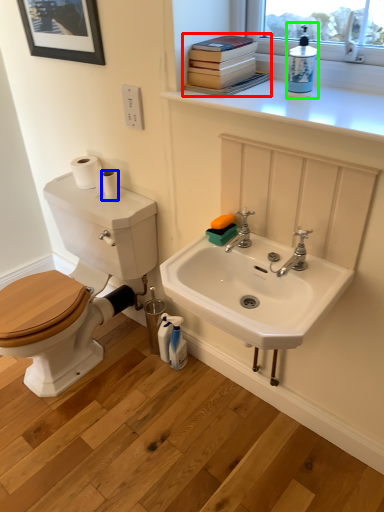
Question: Estimate the real-world distances between objects in this image. Which object is farther from book (highlighted by a red box), toilet paper (highlighted by a blue box) or cleaning product (highlighted by a green box)?

Choices:
 (A) toilet paper
 (B) cleaning product

Answer: (A)